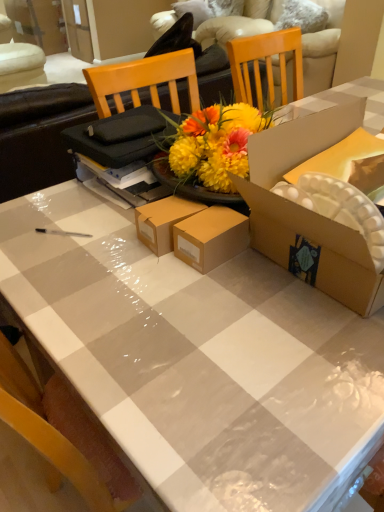
Question: Could beige fabric couch at upper center be considered to be inside cardboard box at center?

Choices:
 (A) yes
 (B) no

Answer: (B)

Question: Considering the relative sizes of cardboard box at center and beige fabric couch at upper center in the image provided, is cardboard box at center smaller than beige fabric couch at upper center?

Choices:
 (A) yes
 (B) no

Answer: (A)

Question: From a real-world perspective, does cardboard box at center stand above beige fabric couch at upper center?

Choices:
 (A) no
 (B) yes

Answer: (B)

Question: Can you confirm if cardboard box at center is shorter than beige fabric couch at upper center?

Choices:
 (A) yes
 (B) no

Answer: (A)

Question: Is cardboard box at center far away from beige fabric couch at upper center?

Choices:
 (A) yes
 (B) no

Answer: (A)

Question: Is cardboard box at center facing away from beige fabric couch at upper center?

Choices:
 (A) yes
 (B) no

Answer: (B)

Question: Is the surface of beige fabric couch at upper center in direct contact with cardboard box at center?

Choices:
 (A) no
 (B) yes

Answer: (A)

Question: Considering the relative sizes of beige fabric couch at upper center and cardboard box at center in the image provided, is beige fabric couch at upper center bigger than cardboard box at center?

Choices:
 (A) no
 (B) yes

Answer: (B)

Question: Considering the relative sizes of beige fabric couch at upper center and cardboard box at center in the image provided, is beige fabric couch at upper center wider than cardboard box at center?

Choices:
 (A) yes
 (B) no

Answer: (A)

Question: Is beige fabric couch at upper center closer to the viewer compared to cardboard box at center?

Choices:
 (A) no
 (B) yes

Answer: (A)

Question: Does beige fabric couch at upper center turn towards cardboard box at center?

Choices:
 (A) no
 (B) yes

Answer: (A)

Question: Considering the relative sizes of beige fabric couch at upper center and cardboard box at center in the image provided, is beige fabric couch at upper center thinner than cardboard box at center?

Choices:
 (A) yes
 (B) no

Answer: (B)

Question: From a real-world perspective, relative to beige fabric couch at upper center, is cardboard box at center vertically above or below?

Choices:
 (A) below
 (B) above

Answer: (B)